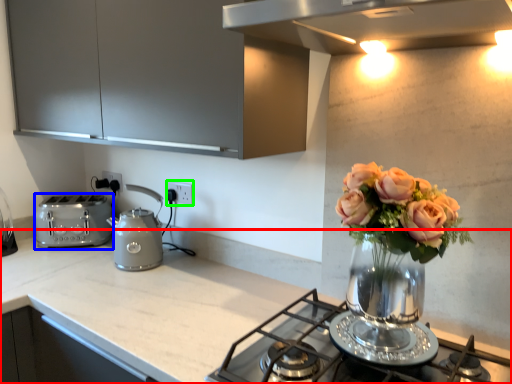
Question: Which object is positioned closest to countertop (highlighted by a red box)? Select from toaster (highlighted by a blue box) and electric outlet (highlighted by a green box).

Choices:
 (A) toaster
 (B) electric outlet

Answer: (A)